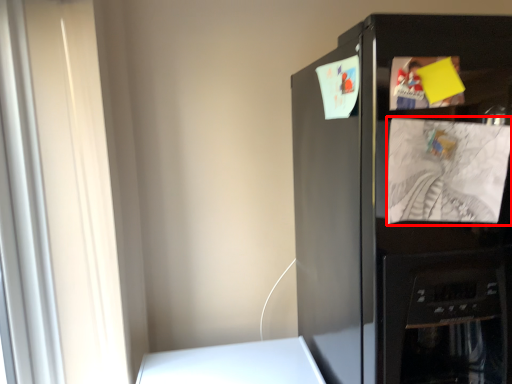
Question: From the image's perspective, what is the correct spatial positioning of paper (annotated by the red box) in reference to refrigerator?

Choices:
 (A) below
 (B) above

Answer: (B)